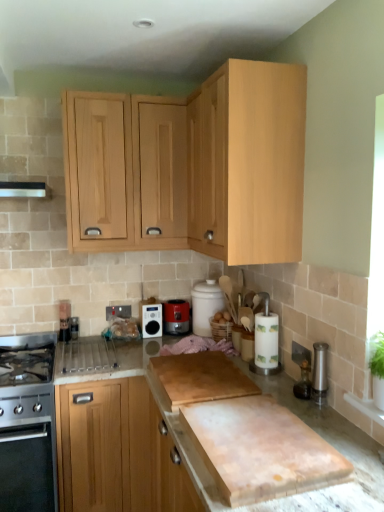
Question: Is light wood cabinet at upper center, which is counted as the first cabinetry, starting from the top, oriented away from metallic silver toaster at lower left?

Choices:
 (A) no
 (B) yes

Answer: (A)

Question: Is light wood cabinet at upper center, which is counted as the first cabinetry, starting from the top, positioned behind metallic silver toaster at lower left?

Choices:
 (A) no
 (B) yes

Answer: (A)

Question: Is light wood cabinet at upper center, which is counted as the first cabinetry, starting from the top, bigger than metallic silver toaster at lower left?

Choices:
 (A) no
 (B) yes

Answer: (B)

Question: From a real-world perspective, is light wood cabinet at upper center, which is counted as the first cabinetry, starting from the top, beneath metallic silver toaster at lower left?

Choices:
 (A) no
 (B) yes

Answer: (A)

Question: From the image's perspective, is light wood cabinet at upper center, the fourth cabinetry in the bottom-to-top sequence, over metallic silver toaster at lower left?

Choices:
 (A) no
 (B) yes

Answer: (B)

Question: Considering the relative positions of light wood cabinet at lower left, positioned as the 1th cabinetry in bottom-to-top order, and stainless steel oven at left, which is the 1th kitchen appliance in bottom-to-top order, in the image provided, is light wood cabinet at lower left, positioned as the 1th cabinetry in bottom-to-top order, to the left or to the right of stainless steel oven at left, which is the 1th kitchen appliance in bottom-to-top order,?

Choices:
 (A) left
 (B) right

Answer: (B)

Question: Considering their positions, is light wood cabinet at lower left, positioned as the 1th cabinetry in bottom-to-top order, located in front of or behind stainless steel oven at left, which is counted as the 3th kitchen appliance, starting from the top?

Choices:
 (A) front
 (B) behind

Answer: (B)

Question: Which is correct: light wood cabinet at lower left, the 4th cabinetry viewed from the top, is inside stainless steel oven at left, marked as the third kitchen appliance in a right-to-left arrangement, or outside of it?

Choices:
 (A) inside
 (B) outside

Answer: (B)

Question: From a real-world perspective, is light wood cabinet at lower left, positioned as the 1th cabinetry in bottom-to-top order, positioned above or below stainless steel oven at left, which is the 1th kitchen appliance in bottom-to-top order?

Choices:
 (A) above
 (B) below

Answer: (A)

Question: From the image's perspective, is stainless steel oven at left, marked as the third kitchen appliance in a right-to-left arrangement, above or below matte black radio at center, the 2th kitchen appliance when ordered from bottom to top?

Choices:
 (A) above
 (B) below

Answer: (B)

Question: Looking at the image, does stainless steel oven at left, which is counted as the 3th kitchen appliance, starting from the top, seem bigger or smaller compared to matte black radio at center, the second kitchen appliance in the right-to-left sequence?

Choices:
 (A) small
 (B) big

Answer: (B)

Question: From a real-world perspective, relative to matte black radio at center, which is the second kitchen appliance in top-to-bottom order, is stainless steel oven at left, marked as the third kitchen appliance in a right-to-left arrangement, vertically above or below?

Choices:
 (A) above
 (B) below

Answer: (B)

Question: Is stainless steel oven at left, marked as the third kitchen appliance in a right-to-left arrangement, taller or shorter than matte black radio at center, which is the second kitchen appliance in top-to-bottom order?

Choices:
 (A) short
 (B) tall

Answer: (B)

Question: In the image, is light wood cabinet at lower left, positioned as the 1th cabinetry in bottom-to-top order, positioned in front of or behind metallic silver toaster at lower left?

Choices:
 (A) behind
 (B) front

Answer: (B)

Question: Choose the correct answer: Is light wood cabinet at lower left, positioned as the 1th cabinetry in bottom-to-top order, inside metallic silver toaster at lower left or outside it?

Choices:
 (A) inside
 (B) outside

Answer: (B)